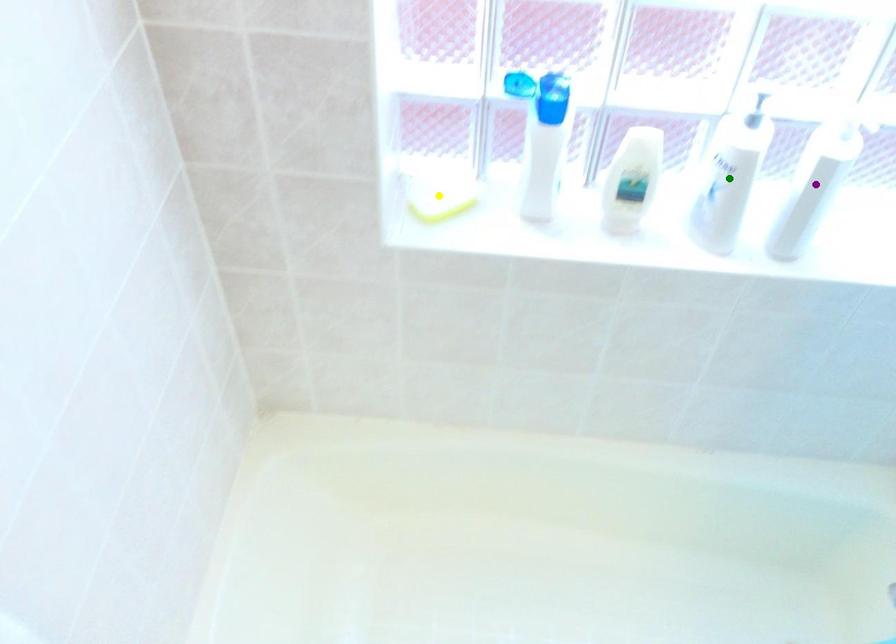
Order these from nearest to farthest:
- yellow point
- purple point
- green point

green point → purple point → yellow point